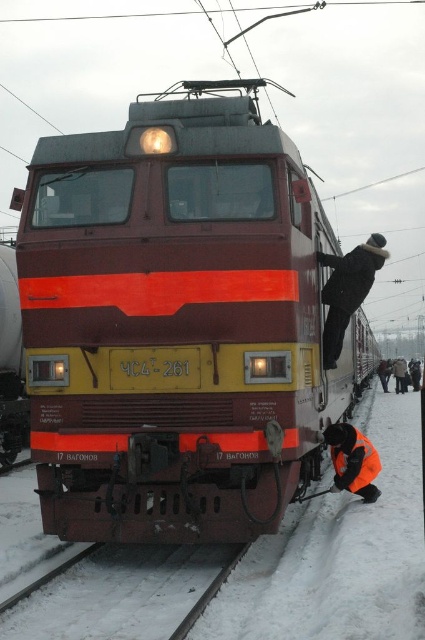
Question: From the image, what is the correct spatial relationship of maroon glossy train at center in relation to black fuzzy hat at upper center?

Choices:
 (A) above
 (B) below

Answer: (A)

Question: Which object is farther from the camera taking this photo?

Choices:
 (A) black fuzzy hat at upper center
 (B) maroon glossy train at center
 (C) orange reflective safety vest at lower center

Answer: (A)

Question: Which point appears farthest from the camera in this image?

Choices:
 (A) (164, 580)
 (B) (322, 259)

Answer: (B)

Question: Which object appears closest to the camera in this image?

Choices:
 (A) maroon glossy train at center
 (B) orange reflective safety vest at lower center

Answer: (A)

Question: Does maroon glossy train at center appear on the right side of black fuzzy hat at upper center?

Choices:
 (A) no
 (B) yes

Answer: (A)

Question: In this image, where is snowy steel train track at lower left located relative to black fuzzy hat at upper center?

Choices:
 (A) above
 (B) below

Answer: (B)